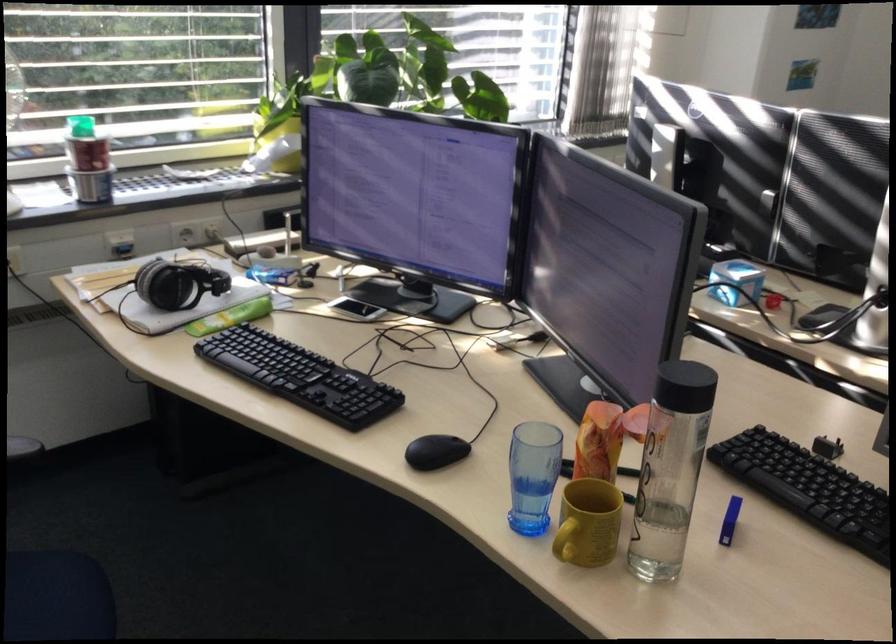
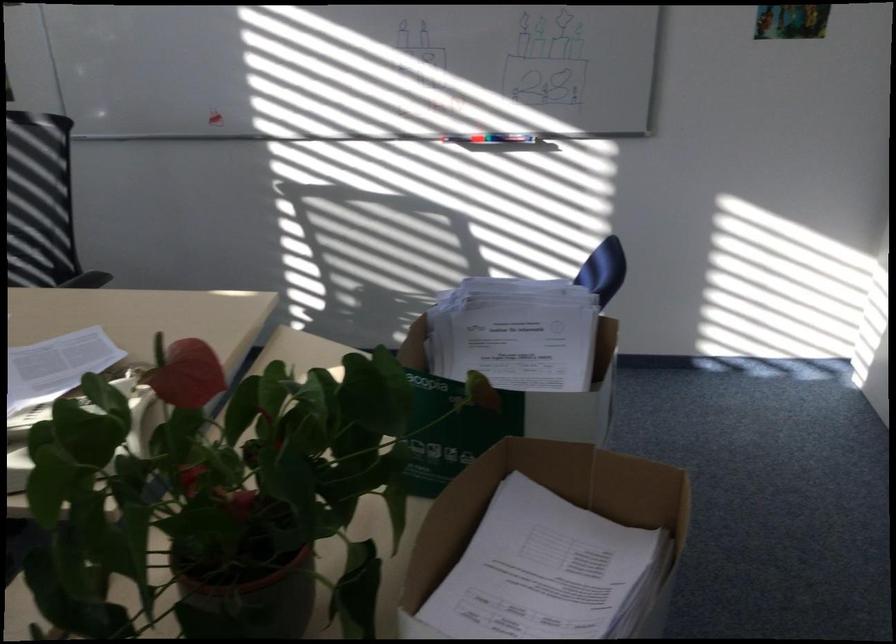
Question: The camera is either moving clockwise (left) or counter-clockwise (right) around the object. The first image is from the beginning of the video and the second image is from the end. Is the camera moving left or right when shooting the video?

Choices:
 (A) Left
 (B) Right

Answer: (A)